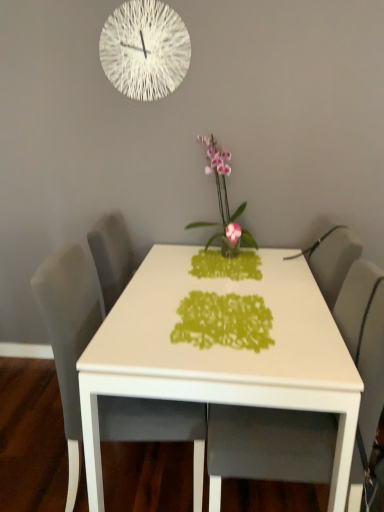
Identify the location of unoccupied area in front of green paper cutout at center. The image size is (384, 512). (241, 366).